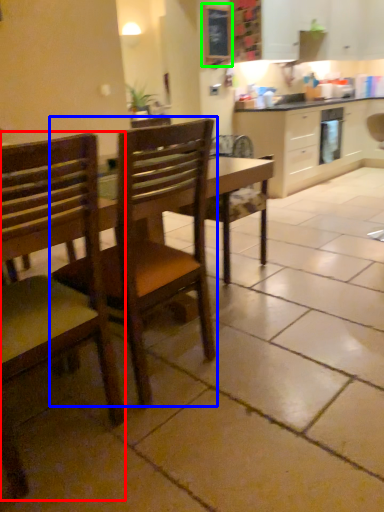
Question: Considering the real-world distances, which object is closest to chair (highlighted by a red box)? chair (highlighted by a blue box) or bulletin board (highlighted by a green box).

Choices:
 (A) chair
 (B) bulletin board

Answer: (A)